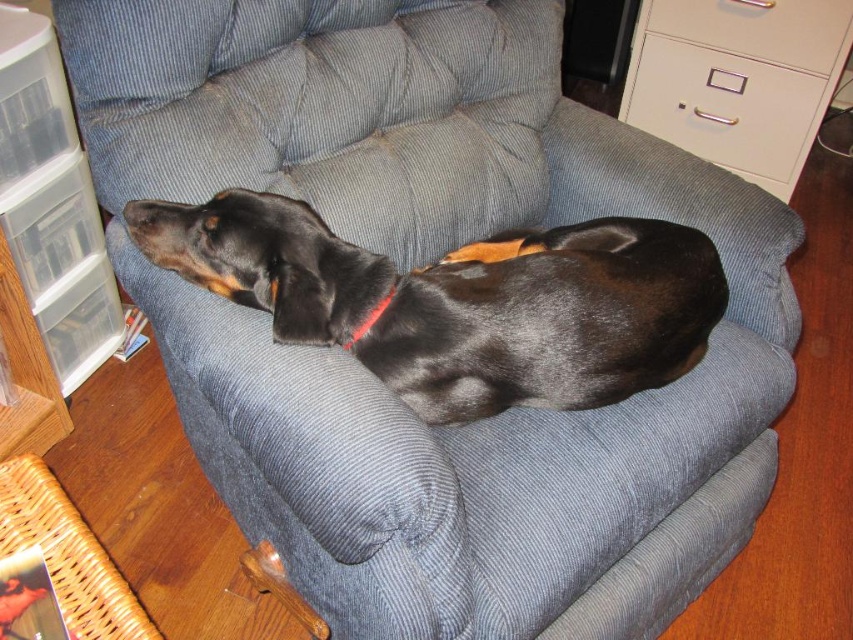
You are standing in front of a black and tan dog lying on a blue recliner chair. You want to place a small treat exactly at the point marked as point (495, 394). If the treat is 0.3 meters in diameter, will it fit entirely within the area of the blue recliner chair?

The point (495, 394) is 1.20 meters away from the camera. Since the treat is 0.3 meters in diameter, it will fit entirely within the area of the blue recliner chair as long as the chair is large enough to accommodate the treat at that distance. However, the exact dimensions of the chair are not provided, so we cannot confirm with certainty.

You are a delivery person entering a home and need to place a package on the nearest available surface. You see a black smooth dog at center and a metallic gray file cabinet at upper right. Which object can you place the package on?

The metallic gray file cabinet at upper right is the correct surface to place the package because the black smooth dog at center is positioned under it, and the dog is not a stable surface for placing items.

You are a delivery person who needs to place a small package on the tallest object in the room. Based on the scene, which object should you choose between the metallic gray file cabinet at upper right and the red fabric neckband at center?

The metallic gray file cabinet at upper right is much taller than the red fabric neckband at center, so you should place the small package on the metallic gray file cabinet at upper right.